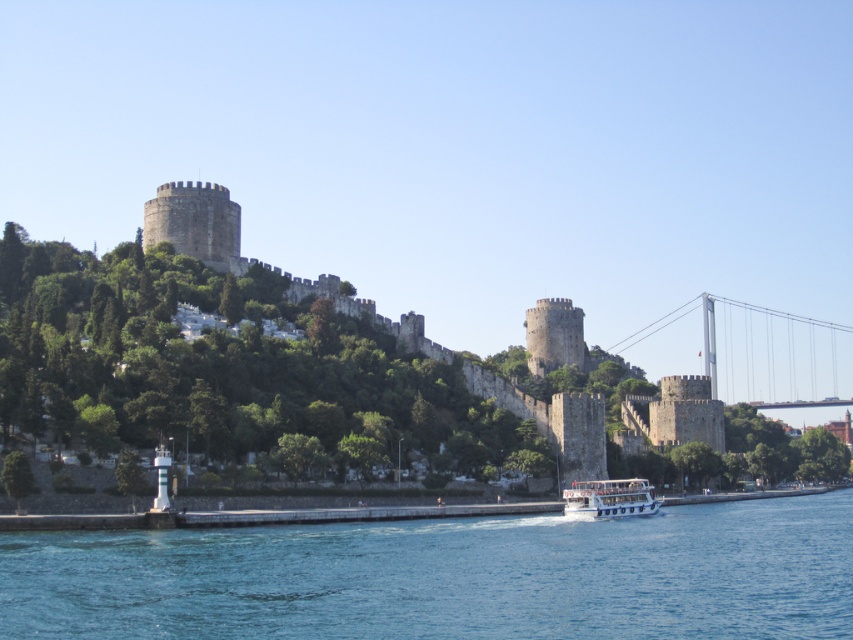
You are standing at the base of the fortress and want to take a photo of the blue water at lower center. According to the coordinates provided, where should you position yourself to capture it in the frame?

The blue water at lower center is located at coordinates point (x=448, y=577), so you should position yourself at that point to capture it in the frame.

You are a tour guide explaining the view to visitors. You mention the blue water at lower center and the white glossy boat at lower center. How far apart are these two elements in meters?

The blue water at lower center and the white glossy boat at lower center are 18.60 meters apart from each other.